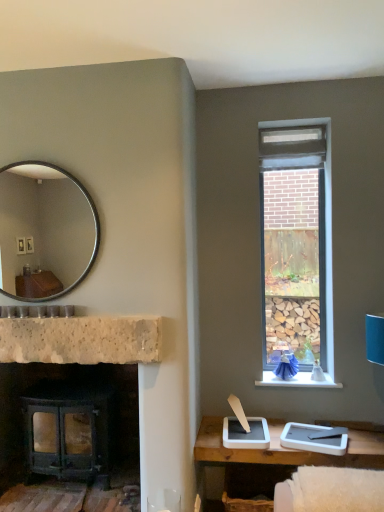
Question: Is white stone window sill at upper right with silver metallic mirror at upper left?

Choices:
 (A) yes
 (B) no

Answer: (B)

Question: Does white stone window sill at upper right have a smaller size compared to silver metallic mirror at upper left?

Choices:
 (A) no
 (B) yes

Answer: (B)

Question: From a real-world perspective, is white stone window sill at upper right positioned over silver metallic mirror at upper left based on gravity?

Choices:
 (A) yes
 (B) no

Answer: (B)

Question: Is white stone window sill at upper right bigger than silver metallic mirror at upper left?

Choices:
 (A) no
 (B) yes

Answer: (A)

Question: Is white stone window sill at upper right to the right of silver metallic mirror at upper left from the viewer's perspective?

Choices:
 (A) yes
 (B) no

Answer: (A)

Question: Does white stone window sill at upper right turn towards silver metallic mirror at upper left?

Choices:
 (A) yes
 (B) no

Answer: (B)

Question: Does natural stone fireplace at center have a lesser width compared to silver metallic mirror at upper left?

Choices:
 (A) yes
 (B) no

Answer: (B)

Question: From a real-world perspective, is natural stone fireplace at center on top of silver metallic mirror at upper left?

Choices:
 (A) no
 (B) yes

Answer: (A)

Question: Can you confirm if natural stone fireplace at center is positioned to the right of silver metallic mirror at upper left?

Choices:
 (A) no
 (B) yes

Answer: (B)

Question: Is natural stone fireplace at center shorter than silver metallic mirror at upper left?

Choices:
 (A) yes
 (B) no

Answer: (A)

Question: Is natural stone fireplace at center located outside silver metallic mirror at upper left?

Choices:
 (A) no
 (B) yes

Answer: (B)

Question: Can you confirm if natural stone fireplace at center is taller than silver metallic mirror at upper left?

Choices:
 (A) no
 (B) yes

Answer: (A)

Question: Is matte black wood-burning stove at lower left thinner than natural stone fireplace at center?

Choices:
 (A) no
 (B) yes

Answer: (A)